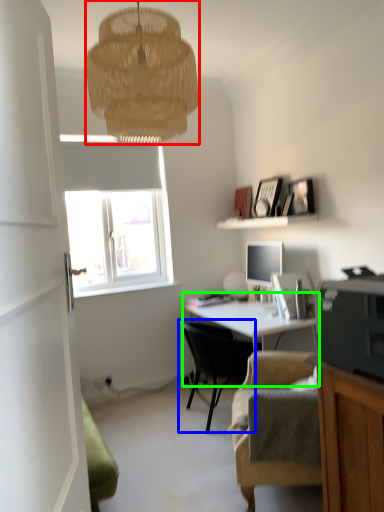
Question: Estimate the real-world distances between objects in this image. Which object is farther from lamp (highlighted by a red box), chair (highlighted by a blue box) or desk (highlighted by a green box)?

Choices:
 (A) chair
 (B) desk

Answer: (A)